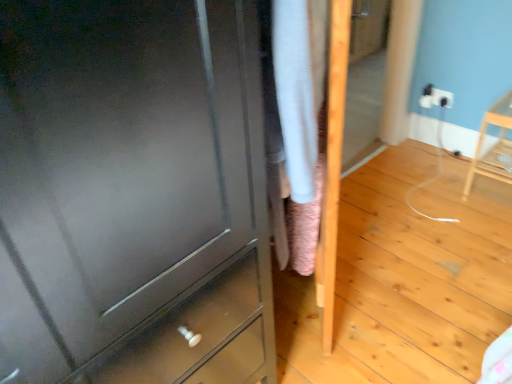
Locate an element on the screen. The width and height of the screenshot is (512, 384). vacant area on the back side of light wood chair at right is located at coordinates (452, 163).